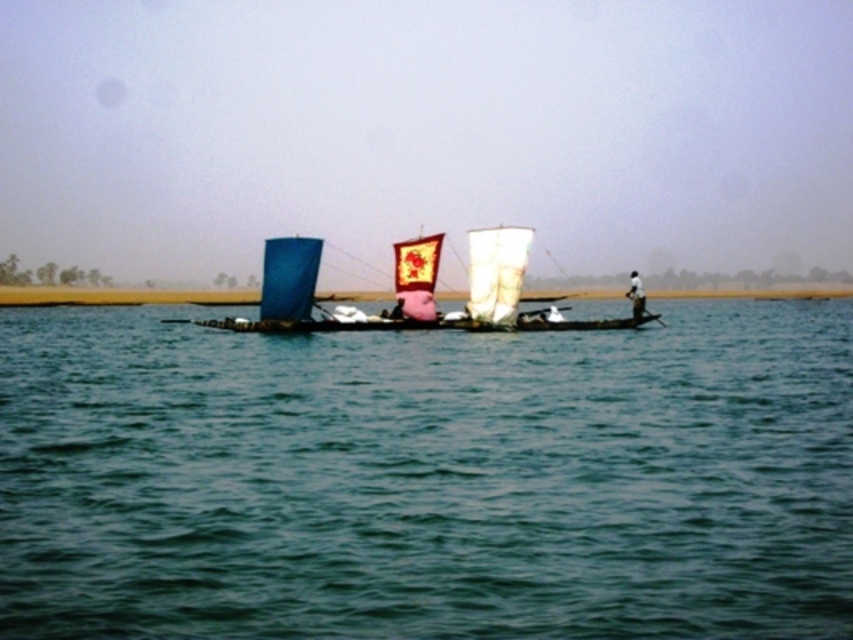
Is green water at center smaller than white fabric boat at right?

No, green water at center is not smaller than white fabric boat at right.

Who is more forward, (354, 544) or (634, 305)?

Point (354, 544) is more forward.

Where is `green water at center`? Image resolution: width=853 pixels, height=640 pixels. green water at center is located at coordinates (427, 477).

Who is positioned more to the right, green water at center or blue fabric sailboat at center?

green water at center is more to the right.

Which is above, green water at center or blue fabric sailboat at center?

Positioned higher is blue fabric sailboat at center.

Find the location of a particular element. The image size is (853, 640). green water at center is located at coordinates (427, 477).

The width and height of the screenshot is (853, 640). I want to click on green water at center, so click(x=427, y=477).

Is blue fabric sailboat at center wider than white fabric boat at right?

Yes.

Is blue fabric sailboat at center closer to camera compared to white fabric boat at right?

Yes, blue fabric sailboat at center is closer to the viewer.

Based on the photo, who is more forward, (438,321) or (643,301)?

Point (643,301) is more forward.

You are a GUI agent. You are given a task and a screenshot of the screen. Output one action in this format:
    pyautogui.click(x=<x>, y=<y>)
    Task: Click on the blue fabric sailboat at center
    
    Given the screenshot: What is the action you would take?
    pyautogui.click(x=403, y=291)